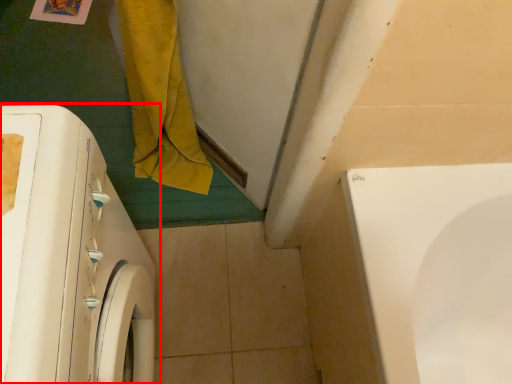
Question: From the image's perspective, what is the correct spatial relationship of washing machine (annotated by the red box) in relation to bath towel?

Choices:
 (A) above
 (B) below

Answer: (B)